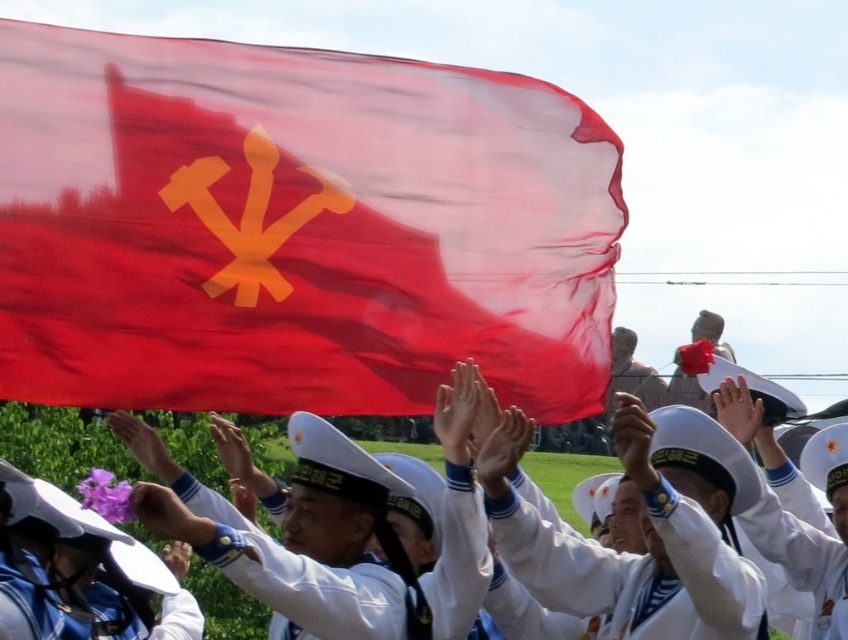
Question: Among these points, which one is nearest to the camera?

Choices:
 (A) (269, 548)
 (B) (336, 204)

Answer: (A)

Question: Does white matte uniform at center lie behind white cotton sailor hat at upper center?

Choices:
 (A) yes
 (B) no

Answer: (B)

Question: Considering the real-world distances, which object is closest to the white matte sailor uniform at center?

Choices:
 (A) white cotton sailor hat at upper center
 (B) white matte uniform at center
 (C) red fabric flag at upper center

Answer: (B)

Question: Which point is farther from the camera taking this photo?

Choices:
 (A) (791, 538)
 (B) (537, 556)
 (C) (282, 611)
 (D) (378, 216)

Answer: (A)

Question: Can you confirm if red fabric flag at upper center is positioned to the right of white matte sailor uniform at center?

Choices:
 (A) yes
 (B) no

Answer: (B)

Question: Can you confirm if white matte uniform at center is positioned to the left of white cotton sailor hat at upper center?

Choices:
 (A) yes
 (B) no

Answer: (A)